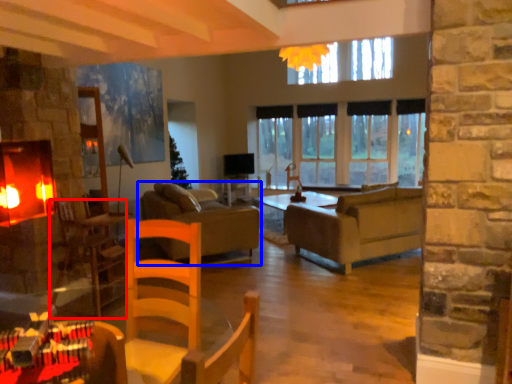
Question: Which object appears farthest to the camera in this image, armchair (highlighted by a red box) or studio couch (highlighted by a blue box)?

Choices:
 (A) armchair
 (B) studio couch

Answer: (B)